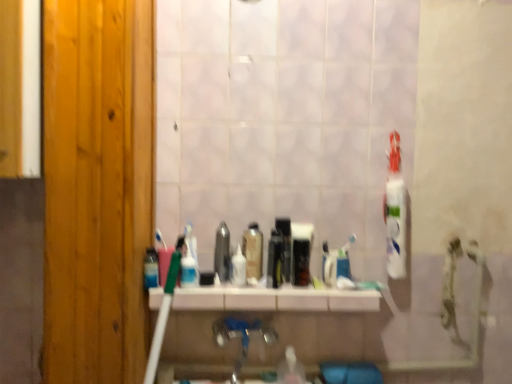
Question: Does translucent plastic mouthwash at center, positioned as the seventh mouthwash in right-to-left order, have a larger size compared to black glossy mouthwash at center, the first mouthwash in the right-to-left sequence?

Choices:
 (A) yes
 (B) no

Answer: (B)

Question: Is translucent plastic mouthwash at center, positioned as the seventh mouthwash in right-to-left order, to the left of black glossy mouthwash at center, the first mouthwash in the right-to-left sequence, from the viewer's perspective?

Choices:
 (A) no
 (B) yes

Answer: (B)

Question: Are translucent plastic mouthwash at center, positioned as the seventh mouthwash in right-to-left order, and black glossy mouthwash at center, acting as the 8th mouthwash starting from the left, making contact?

Choices:
 (A) no
 (B) yes

Answer: (A)

Question: Is the position of translucent plastic mouthwash at center, the 2th mouthwash positioned from the left, less distant than that of black glossy mouthwash at center, acting as the 8th mouthwash starting from the left?

Choices:
 (A) yes
 (B) no

Answer: (A)

Question: From a real-world perspective, is translucent plastic mouthwash at center, positioned as the seventh mouthwash in right-to-left order, over black glossy mouthwash at center, the first mouthwash in the right-to-left sequence?

Choices:
 (A) yes
 (B) no

Answer: (B)

Question: Do you think blue metallic faucet at center is within metallic silver mouthwash at center, which is counted as the third mouthwash, starting from the left, or outside of it?

Choices:
 (A) outside
 (B) inside

Answer: (A)

Question: In terms of width, does blue metallic faucet at center look wider or thinner when compared to metallic silver mouthwash at center, which ranks as the 6th mouthwash in right-to-left order?

Choices:
 (A) thin
 (B) wide

Answer: (B)

Question: From a real-world perspective, is blue metallic faucet at center above or below metallic silver mouthwash at center, which ranks as the 6th mouthwash in right-to-left order?

Choices:
 (A) above
 (B) below

Answer: (B)

Question: From their relative heights in the image, would you say blue metallic faucet at center is taller or shorter than metallic silver mouthwash at center, which is counted as the third mouthwash, starting from the left?

Choices:
 (A) short
 (B) tall

Answer: (A)

Question: Does point (309, 241) appear closer or farther from the camera than point (232, 254)?

Choices:
 (A) farther
 (B) closer

Answer: (A)

Question: Relative to translucent plastic mouthwash at center, which appears as the fifth mouthwash when viewed from the right, is black glossy mouthwash at center, the first mouthwash in the right-to-left sequence, in front or behind?

Choices:
 (A) front
 (B) behind

Answer: (B)

Question: Considering the positions of black glossy mouthwash at center, acting as the 8th mouthwash starting from the left, and translucent plastic mouthwash at center, marked as the 4th mouthwash in a left-to-right arrangement, in the image, is black glossy mouthwash at center, acting as the 8th mouthwash starting from the left, taller or shorter than translucent plastic mouthwash at center, marked as the 4th mouthwash in a left-to-right arrangement,?

Choices:
 (A) short
 (B) tall

Answer: (B)

Question: From a real-world perspective, is black glossy mouthwash at center, the first mouthwash in the right-to-left sequence, physically located above or below translucent plastic mouthwash at center, marked as the 4th mouthwash in a left-to-right arrangement?

Choices:
 (A) above
 (B) below

Answer: (A)

Question: From the image's perspective, relative to black glossy mouthwash at center, acting as the 8th mouthwash starting from the left, is blue metallic faucet at center above or below?

Choices:
 (A) above
 (B) below

Answer: (B)

Question: Relative to black glossy mouthwash at center, acting as the 8th mouthwash starting from the left, is blue metallic faucet at center in front or behind?

Choices:
 (A) front
 (B) behind

Answer: (A)